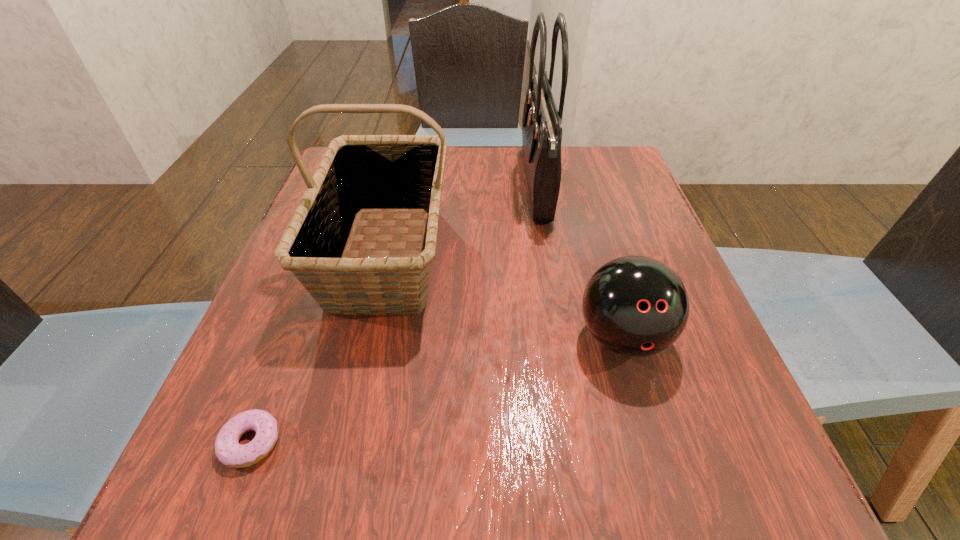
Locate an element on the screen. The height and width of the screenshot is (540, 960). vacant region located on the right of the shortest object is located at coordinates (556, 442).

Locate an element on the screen. The image size is (960, 540). object that is at the far edge is located at coordinates (542, 123).

Identify the location of object situated at the near edge. The image size is (960, 540). (229, 452).

Where is `basket situated at the left edge`? basket situated at the left edge is located at coordinates (358, 174).

Identify the location of doughnut positioned at the left edge. This screenshot has height=540, width=960. (229, 452).

Find the location of a particular element. object located at the right edge is located at coordinates (636, 306).

Find the location of a particular element. Image resolution: width=960 pixels, height=540 pixels. object at the near left corner is located at coordinates (229, 452).

Locate an element on the screen. vacant space at the far edge of the desktop is located at coordinates (496, 149).

Identify the location of blank space at the near edge. (583, 488).

In the image, there is a desktop. Identify the location of vacant space at the right edge. The height and width of the screenshot is (540, 960). (640, 406).